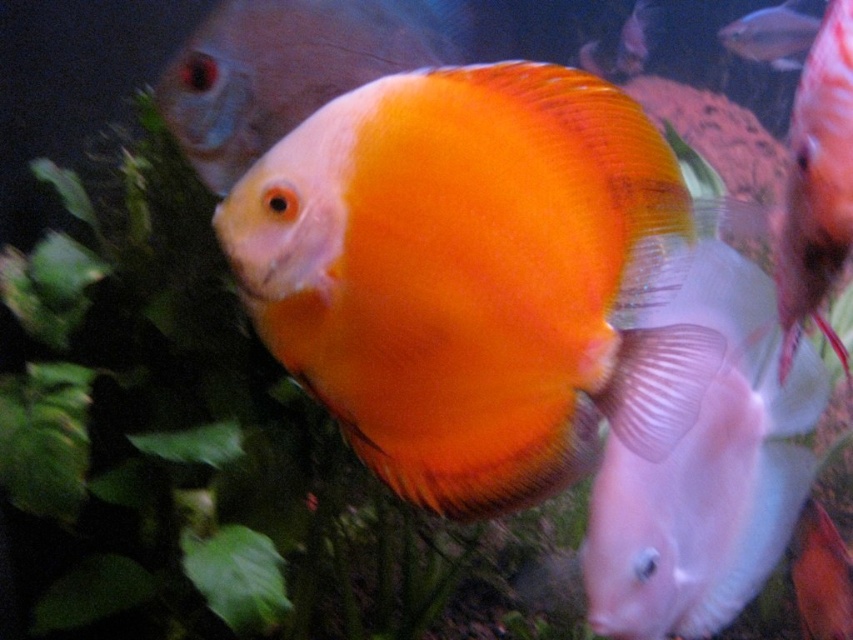
Question: Can you confirm if orange matte discus at center is smaller than orange matte goldfish at center?

Choices:
 (A) yes
 (B) no

Answer: (A)

Question: Which point is farther to the camera?

Choices:
 (A) orange matte discus at center
 (B) orange matte fish at center
 (C) orange matte goldfish at center

Answer: (B)

Question: Which object is positioned farthest from the translucent glass fish at upper right?

Choices:
 (A) matte white fish at lower right
 (B) orange matte discus at center

Answer: (B)

Question: Can you confirm if orange matte discus at center is positioned above matte white fish at lower right?

Choices:
 (A) no
 (B) yes

Answer: (B)

Question: Is orange matte discus at center in front of translucent glass fish at upper right?

Choices:
 (A) no
 (B) yes

Answer: (B)

Question: Which point appears farthest from the camera in this image?

Choices:
 (A) (728, 44)
 (B) (848, 17)

Answer: (A)